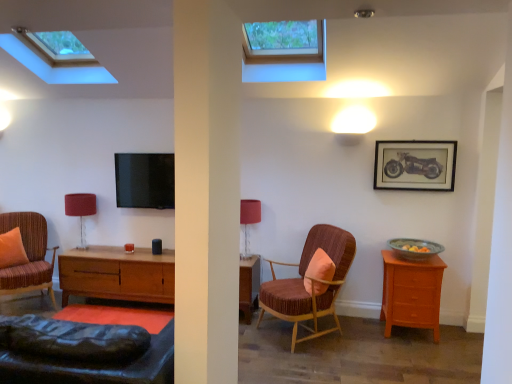
Question: From the image's perspective, would you say matte red table lamp at center, the first table lamp from the right, is positioned over light brown wood nightstand at right?

Choices:
 (A) no
 (B) yes

Answer: (B)

Question: Considering the relative sizes of matte red table lamp at center, positioned as the second table lamp in back-to-front order, and light brown wood nightstand at right in the image provided, is matte red table lamp at center, positioned as the second table lamp in back-to-front order, smaller than light brown wood nightstand at right?

Choices:
 (A) yes
 (B) no

Answer: (A)

Question: Are matte red table lamp at center, marked as the first table lamp in a front-to-back arrangement, and light brown wood nightstand at right far apart?

Choices:
 (A) yes
 (B) no

Answer: (A)

Question: Is matte red table lamp at center, which appears as the 2th table lamp when viewed from the left, shorter than light brown wood nightstand at right?

Choices:
 (A) no
 (B) yes

Answer: (B)

Question: Is light brown wood nightstand at right completely or partially inside matte red table lamp at center, the first table lamp from the right?

Choices:
 (A) no
 (B) yes

Answer: (A)

Question: In terms of width, does light brown wood nightstand at right look wider or thinner when compared to striped fabric armchair at left, the first chair positioned from the left?

Choices:
 (A) wide
 (B) thin

Answer: (B)

Question: From the image's perspective, is light brown wood nightstand at right above or below striped fabric armchair at left, the first chair positioned from the left?

Choices:
 (A) below
 (B) above

Answer: (A)

Question: Is light brown wood nightstand at right taller or shorter than striped fabric armchair at left, the first chair positioned from the left?

Choices:
 (A) short
 (B) tall

Answer: (A)

Question: Visually, is light brown wood nightstand at right positioned to the left or to the right of striped fabric armchair at left, marked as the second chair in a right-to-left arrangement?

Choices:
 (A) right
 (B) left

Answer: (A)

Question: From the image's perspective, is transparent glass window at upper center, the 2th window viewed from the left, located above or below matte red table lamp at center, which appears as the 2th table lamp when viewed from the left?

Choices:
 (A) above
 (B) below

Answer: (A)

Question: Relative to matte red table lamp at center, marked as the first table lamp in a front-to-back arrangement, is transparent glass window at upper center, the 2th window viewed from the left, in front or behind?

Choices:
 (A) front
 (B) behind

Answer: (A)

Question: Is transparent glass window at upper center, marked as the 1th window in a right-to-left arrangement, wider or thinner than matte red table lamp at center, the first table lamp from the right?

Choices:
 (A) wide
 (B) thin

Answer: (A)

Question: From a real-world perspective, relative to matte red table lamp at center, the first table lamp from the right, is transparent glass window at upper center, the 2th window viewed from the left, vertically above or below?

Choices:
 (A) below
 (B) above

Answer: (B)

Question: Based on their sizes in the image, would you say matte red table lamp at center, positioned as the second table lamp in back-to-front order, is bigger or smaller than orange fabric pillow at center, which ranks as the second pillow in back-to-front order?

Choices:
 (A) big
 (B) small

Answer: (A)

Question: Relative to orange fabric pillow at center, which ranks as the second pillow in back-to-front order, is matte red table lamp at center, which appears as the 2th table lamp when viewed from the left, in front or behind?

Choices:
 (A) front
 (B) behind

Answer: (B)